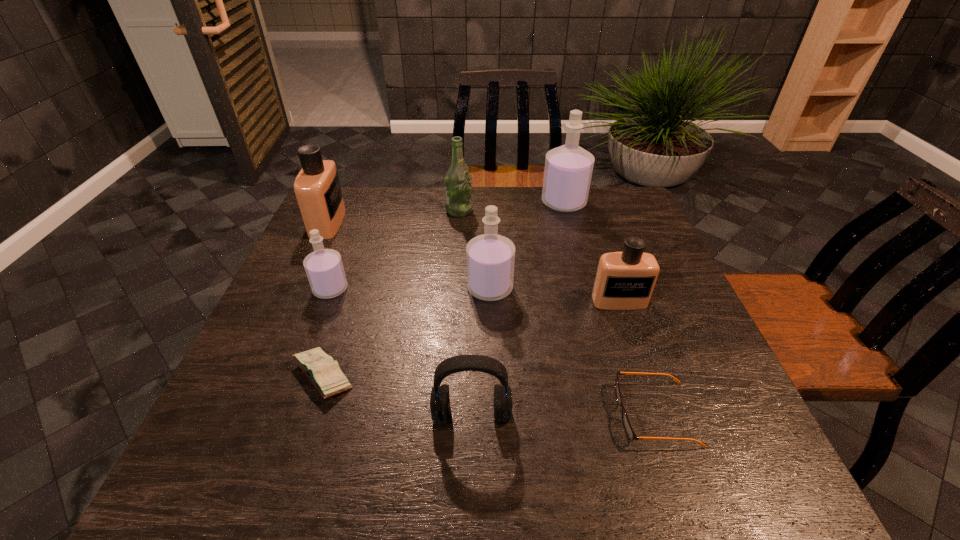
Find the location of a particular element. headset is located at coordinates [440, 398].

In order to click on pink diary in this screenshot , I will do `click(324, 373)`.

You are a GUI agent. You are given a task and a screenshot of the screen. Output one action in this format:
    pyautogui.click(x=<x>, y=<y>)
    Task: Click on the spectacles
    Image resolution: width=960 pixels, height=540 pixels.
    Given the screenshot: What is the action you would take?
    pyautogui.click(x=628, y=428)

Locate an element on the screen. This screenshot has height=540, width=960. free space located 0.380m on the left of the biggest purple perfume is located at coordinates (424, 203).

Where is `vacant point located 0.200m on the surface of the beer bottle`? vacant point located 0.200m on the surface of the beer bottle is located at coordinates (536, 211).

Locate an element on the screen. This screenshot has width=960, height=540. vacant area situated 0.120m on the front label of the bigger beige perfume is located at coordinates (382, 223).

Image resolution: width=960 pixels, height=540 pixels. Identify the location of vacant space located on the right of the third perfume from left to right. point(584,288).

The height and width of the screenshot is (540, 960). Identify the location of free region located on the right of the smallest purple perfume. (446, 289).

Image resolution: width=960 pixels, height=540 pixels. Identify the location of vacant point located 0.390m on the front label of the nearer beige perfume. (677, 470).

Find the location of a particular element. free space located on the headband of the headset is located at coordinates (470, 491).